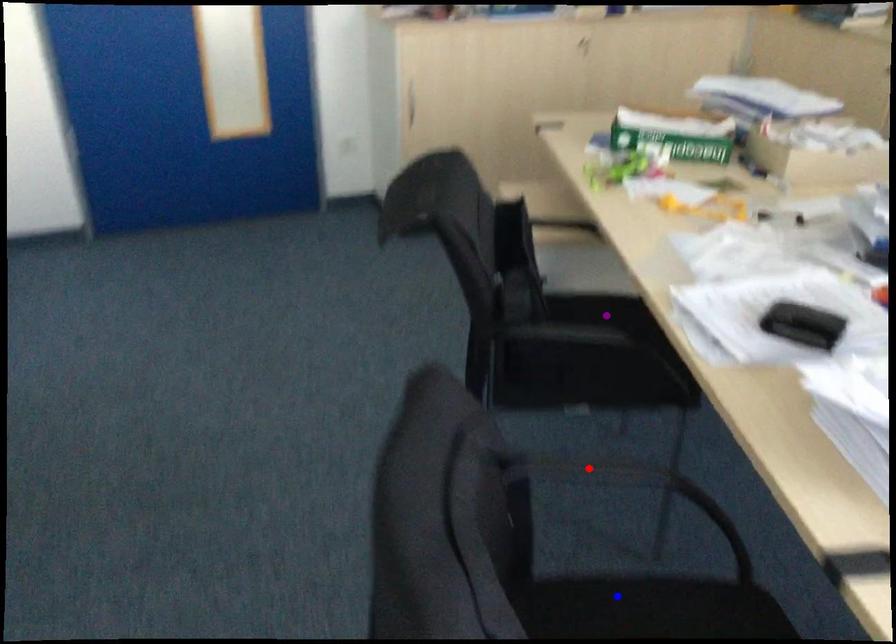
Order these from nearest to farthest:
A) blue point
B) red point
C) purple point

blue point < purple point < red point